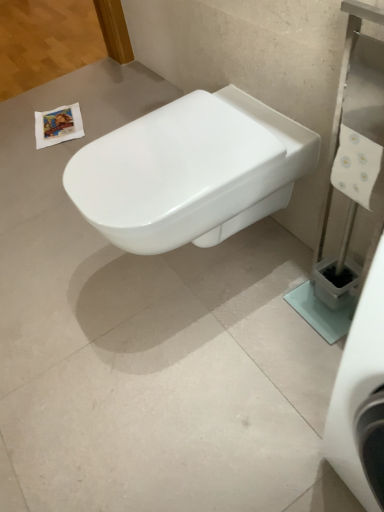
The height and width of the screenshot is (512, 384). Describe the element at coordinates (190, 170) in the screenshot. I see `white glossy toilet at center` at that location.

Image resolution: width=384 pixels, height=512 pixels. Identify the location of white glossy toilet at center. (190, 170).

You are a GUI agent. You are given a task and a screenshot of the screen. Output one action in this format:
    pyautogui.click(x=<x>, y=<y>)
    Task: Click on the white glossy toilet at center
    Image resolution: width=384 pixels, height=512 pixels.
    Given the screenshot: What is the action you would take?
    pyautogui.click(x=190, y=170)